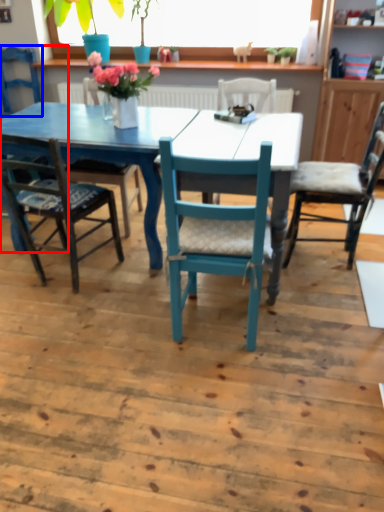
Question: Which object is further to the camera taking this photo, chair (highlighted by a red box) or chair (highlighted by a blue box)?

Choices:
 (A) chair
 (B) chair

Answer: (B)